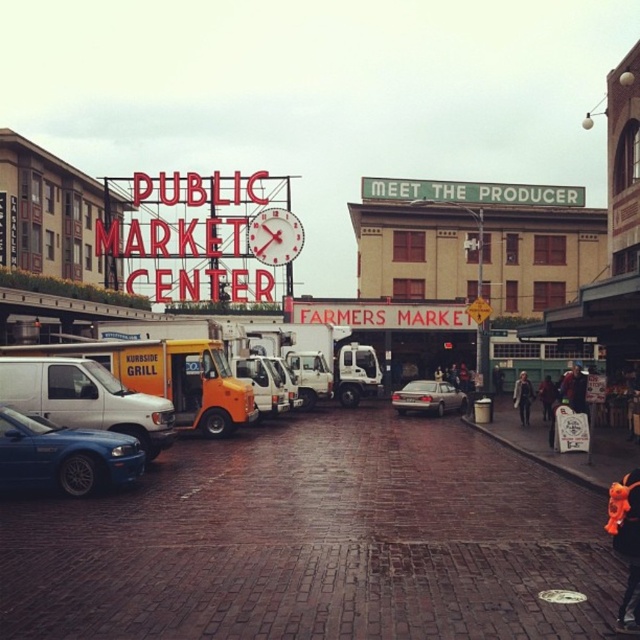
Is point (259, 252) closer to viewer compared to point (529, 400)?

No.

Who is taller, white plastic clock at center or light brown leather jacket at center?

With more height is white plastic clock at center.

Is point (269, 234) less distant than point (531, 396)?

That is False.

Identify the location of white plastic clock at center. (275, 236).

Does white matte van at left appear on the right side of white plastic clock at center?

No, white matte van at left is not to the right of white plastic clock at center.

Who is more distant from viewer, [124,410] or [269,248]?

Point [269,248]

Locate an element on the screen. This screenshot has height=640, width=640. white matte van at left is located at coordinates (84, 397).

Locate an element on the screen. white matte van at left is located at coordinates (84, 397).

The height and width of the screenshot is (640, 640). Find the location of `white matte van at left`. white matte van at left is located at coordinates (84, 397).